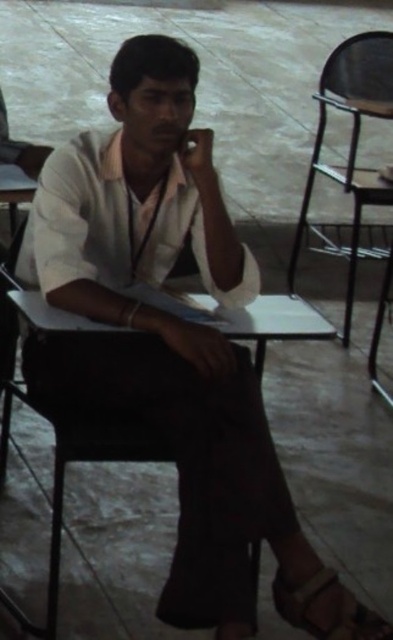
You are standing in front of the desk and want to place a small object on the desk. There are two points on the desk marked as point 1 at coordinates (352, 284) and point 2 at coordinates (315, 625). Which point is closer to you so that you can easily reach it without moving your body?

Point 1 at coordinates (352, 284) is further to the camera than point 2 at coordinates (315, 625), so point 2 is closer to you and easier to reach without moving your body.

You are a person who is 1.7 meters tall and you want to sit on the metallic black chair at right. Considering the height of the chair compared to the brown leather sandal at lower right, will your feet touch the ground?

The metallic black chair at right is taller than the brown leather sandal at lower right. Since the chair is taller than the sandal, it is possible that the chair is of a standard height. However, without specific measurements, it is difficult to determine if your feet will touch the ground. Consider checking the chair height before sitting.

You are a delivery person who needs to place a small package between the metallic black chair at right and the brown leather sandal at lower right. Can you fit the package there if it requires a space of at least 8 feet between the two objects?

The metallic black chair at right is 7.30 feet from the brown leather sandal at lower right. Since the required space is 8 feet, the package cannot be placed there as the available space is insufficient.